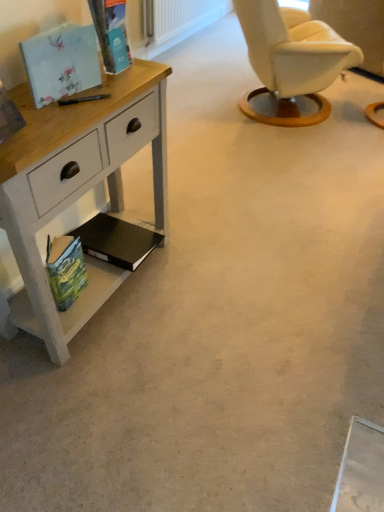
Find the location of a particular element. vacant space that is in between white painted wood desk at left and black matte book at lower left, arranged as the third magazine when viewed from the top is located at coordinates (121, 303).